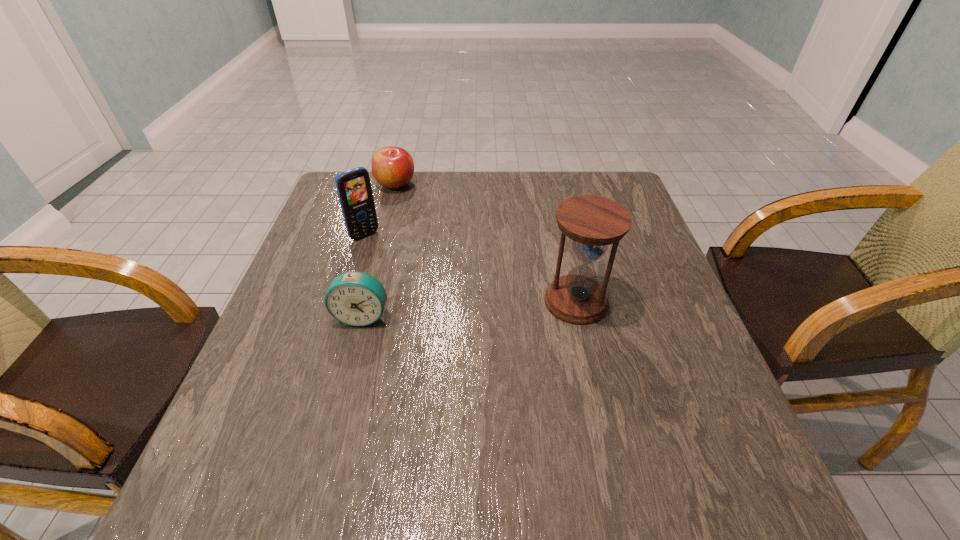
Where is `free space located on the screen of the third nearest object`? The image size is (960, 540). free space located on the screen of the third nearest object is located at coordinates (441, 311).

Where is `free space located 0.070m on the stem of the apple`? Image resolution: width=960 pixels, height=540 pixels. free space located 0.070m on the stem of the apple is located at coordinates (413, 206).

In order to click on free region located on the stem of the apple in this screenshot , I will do `click(425, 220)`.

Locate an element on the screen. Image resolution: width=960 pixels, height=540 pixels. free space located 0.130m on the stem of the apple is located at coordinates (422, 216).

The height and width of the screenshot is (540, 960). I want to click on object located in the far edge section of the desktop, so click(393, 167).

You are a GUI agent. You are given a task and a screenshot of the screen. Output one action in this format:
    pyautogui.click(x=<x>, y=<y>)
    Task: Click on the alarm clock present at the left edge
    
    Given the screenshot: What is the action you would take?
    pyautogui.click(x=354, y=298)

The width and height of the screenshot is (960, 540). In order to click on cellular telephone that is at the left edge in this screenshot , I will do `click(354, 189)`.

Where is `apple located in the left edge section of the desktop`? The height and width of the screenshot is (540, 960). apple located in the left edge section of the desktop is located at coordinates (393, 167).

In order to click on object located at the far left corner in this screenshot , I will do `click(393, 167)`.

Where is `free space at the far edge of the desktop`? The image size is (960, 540). free space at the far edge of the desktop is located at coordinates (559, 191).